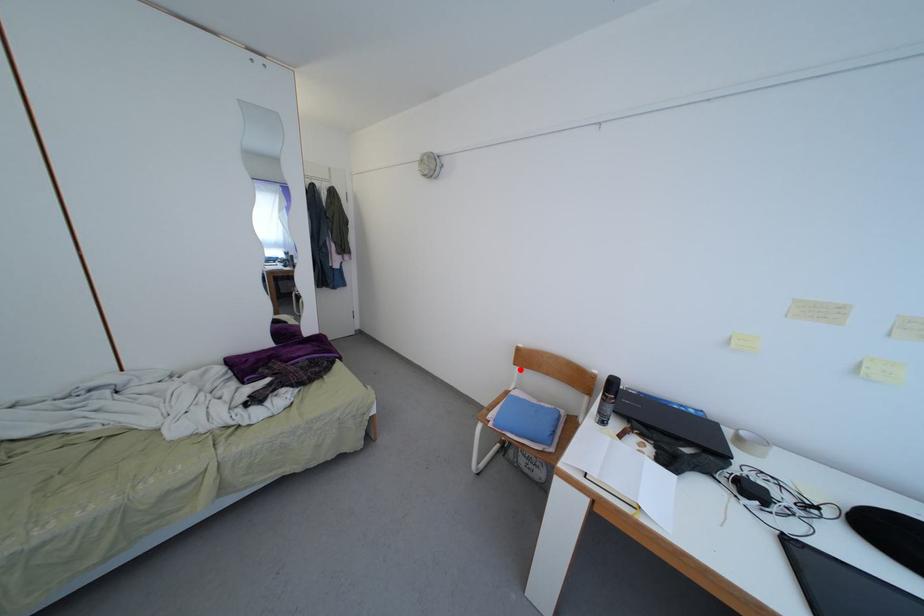
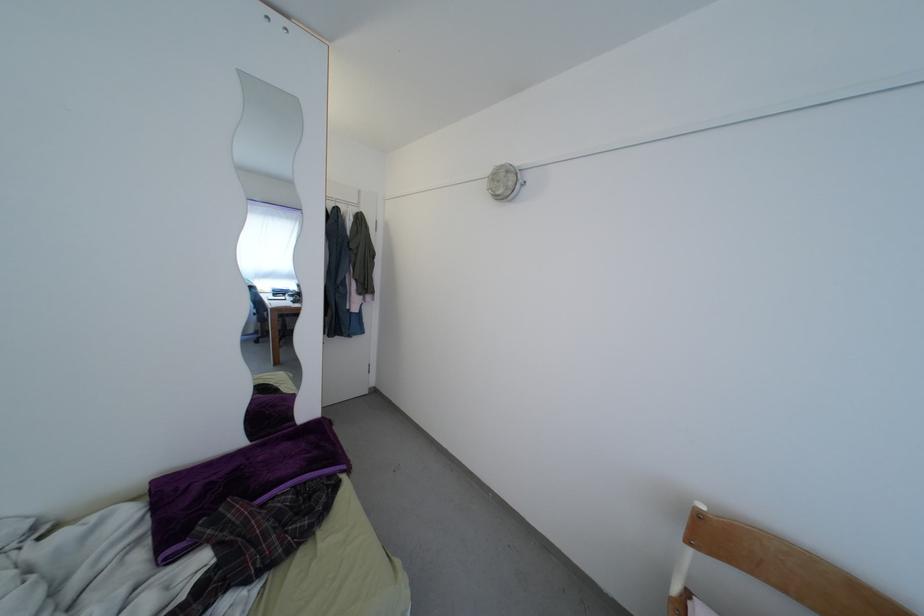
Find the pixel in the second image that matches the highlighted location in the first image.

(694, 548)